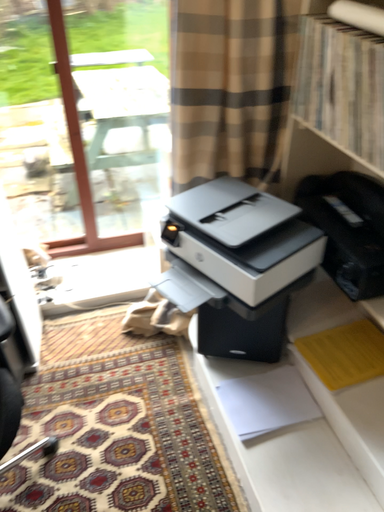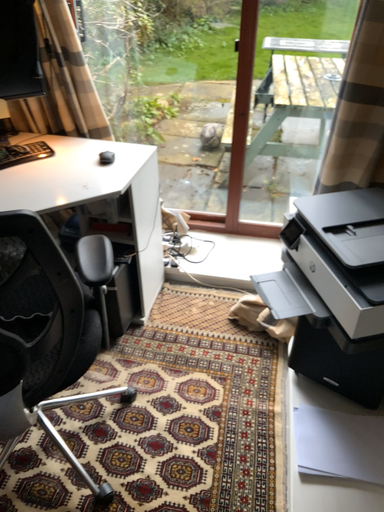
Question: Which way did the camera rotate in the video?

Choices:
 (A) rotated left
 (B) rotated right

Answer: (A)